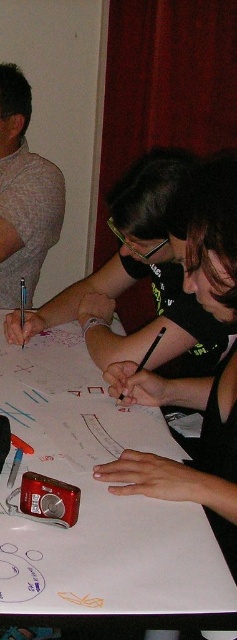
You are an observer standing at the side of the table. You see the white paper at center and the gray matte shirt at left. Which object is closer to you?

The gray matte shirt at left is closer to you because it is positioned over the white paper at center, indicating it is nearer in the visual hierarchy.

You are an artist trying to decide where to place your next drawing. You have a white paper at center and a gray matte shirt at left. Which surface allows for a larger drawing in terms of width?

The white paper at center has a larger width than the gray matte shirt at left, so it allows for a larger drawing in terms of width.